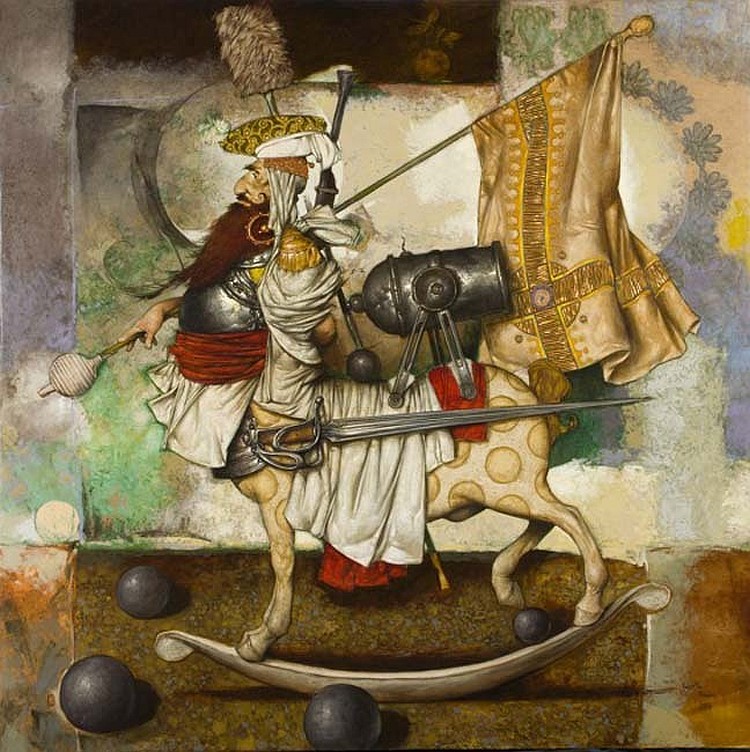
Find the location of a particular element. rocking horse is located at coordinates (582, 623).